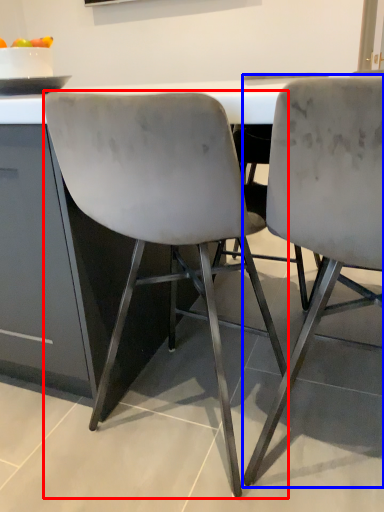
Question: Which point is further to the camera, chair (highlighted by a red box) or chair (highlighted by a blue box)?

Choices:
 (A) chair
 (B) chair

Answer: (A)